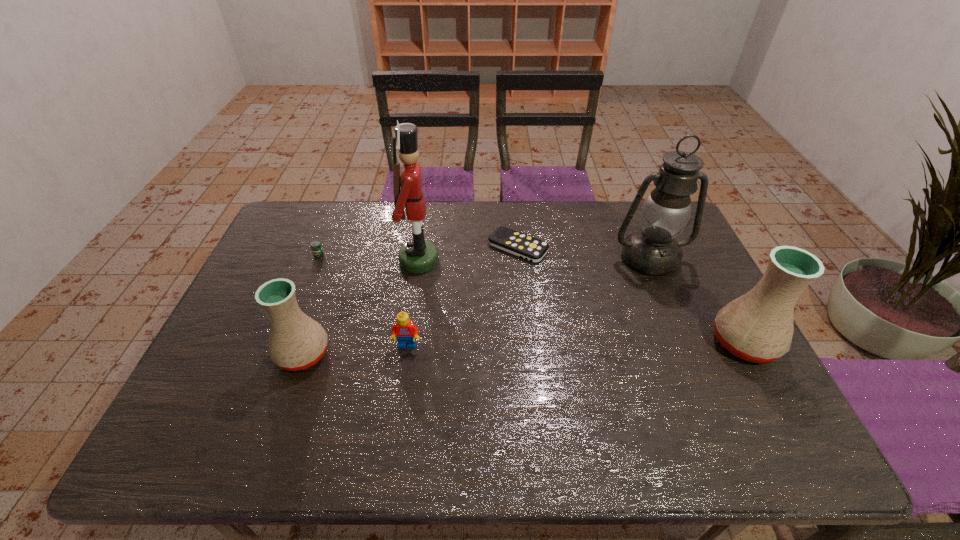
The width and height of the screenshot is (960, 540). Find the location of `the left pottery`. the left pottery is located at coordinates point(297,342).

Find the location of `the shorter pottery`. the shorter pottery is located at coordinates (x=297, y=342).

Image resolution: width=960 pixels, height=540 pixels. I want to click on the taller pottery, so tap(758, 327).

Where is `the fifth shortest object`? the fifth shortest object is located at coordinates (758, 327).

Where is `the fifth object from left to right`? The height and width of the screenshot is (540, 960). the fifth object from left to right is located at coordinates (524, 246).

The image size is (960, 540). In order to click on the shortest object in this screenshot , I will do `click(524, 246)`.

This screenshot has width=960, height=540. I want to click on oil lamp, so click(666, 212).

At what (x,y) coordinates should I click in order to perform the action: click on beer can. Please return your answer as a coordinate pair (x, y). Image resolution: width=960 pixels, height=540 pixels. Looking at the image, I should click on (316, 247).

This screenshot has height=540, width=960. I want to click on nutcracker, so click(419, 255).

What are the coordinates of `the third shortest object` in the screenshot? It's located at (406, 331).